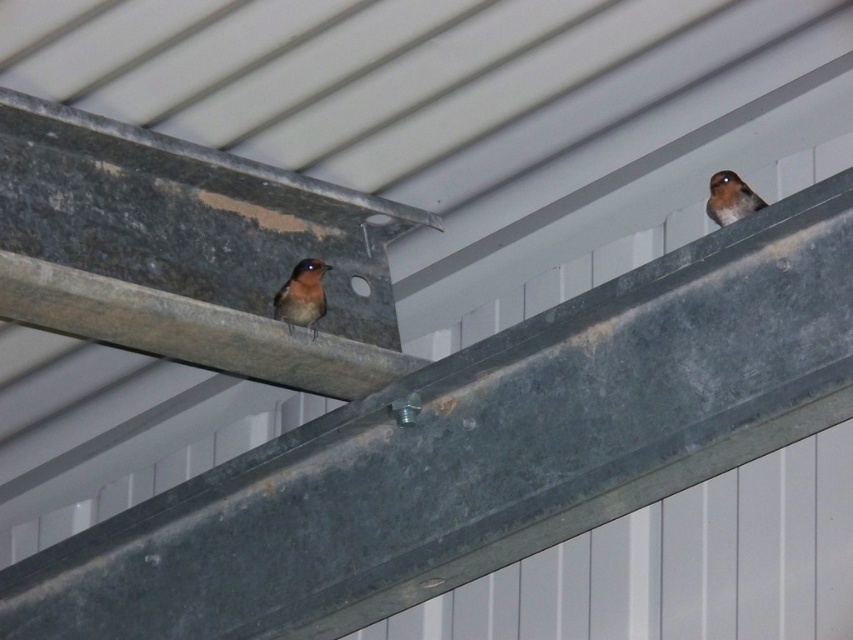
Question: Considering the relative positions of brown feathered bird at center and brown feathered bird at upper right in the image provided, where is brown feathered bird at center located with respect to brown feathered bird at upper right?

Choices:
 (A) left
 (B) right

Answer: (A)

Question: Is brown feathered bird at center below brown feathered bird at upper right?

Choices:
 (A) no
 (B) yes

Answer: (B)

Question: Is brown feathered bird at center wider than brown feathered bird at upper right?

Choices:
 (A) no
 (B) yes

Answer: (B)

Question: Which object appears closest to the camera in this image?

Choices:
 (A) brown feathered bird at center
 (B) brown feathered bird at upper right

Answer: (B)